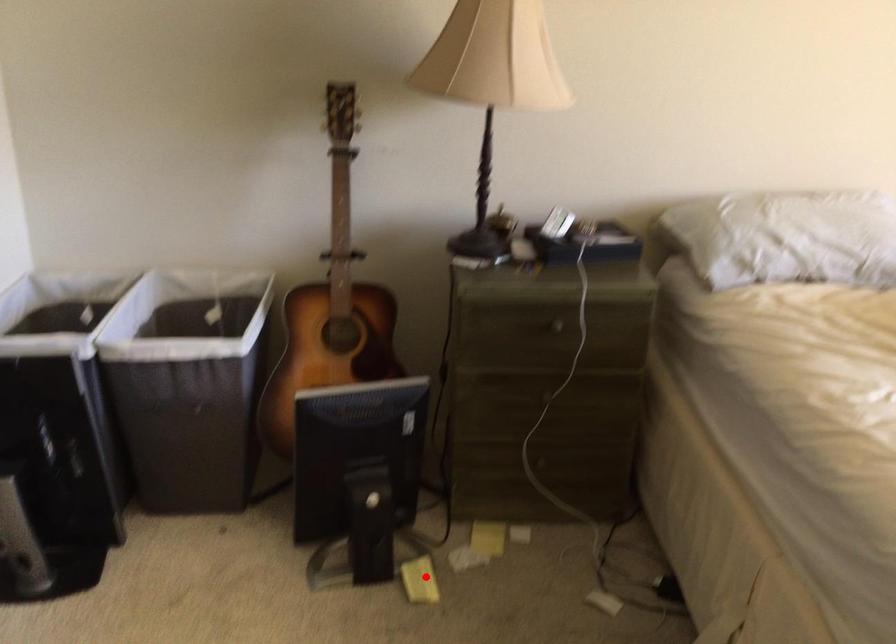
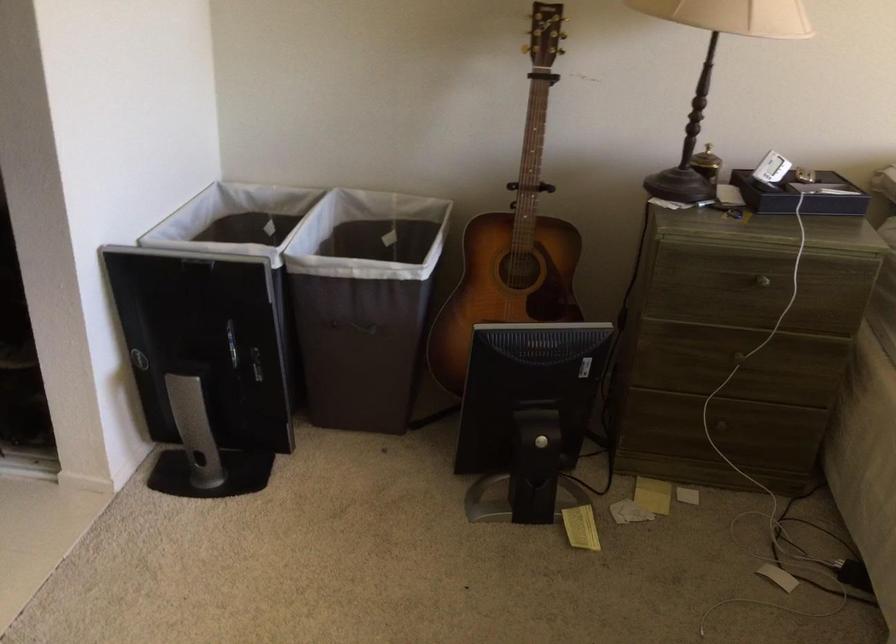
Question: I am providing you with two images of the same scene from different viewpoints. A red point is marked on the first image. Can you still see the location of the red point in image 2?

Choices:
 (A) Yes
 (B) No

Answer: (A)